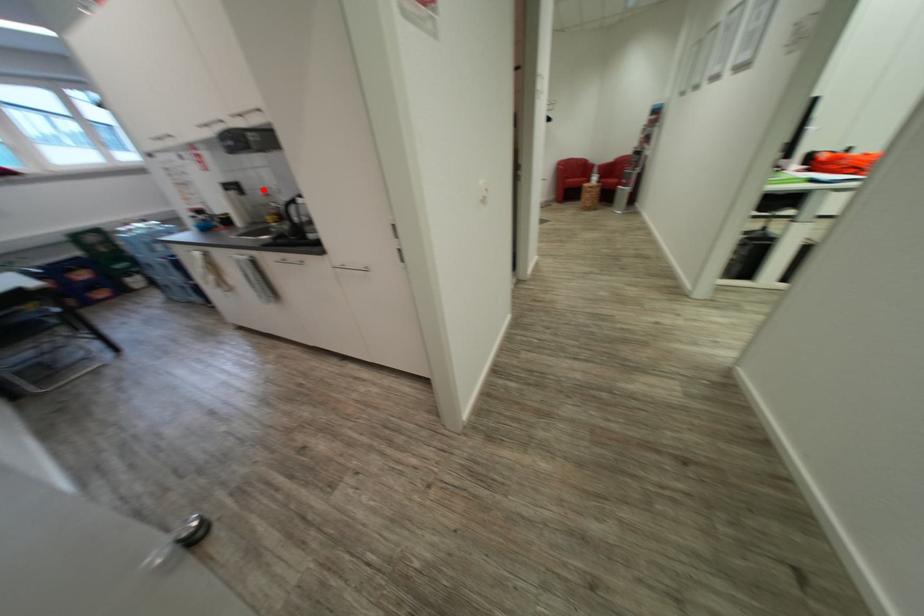
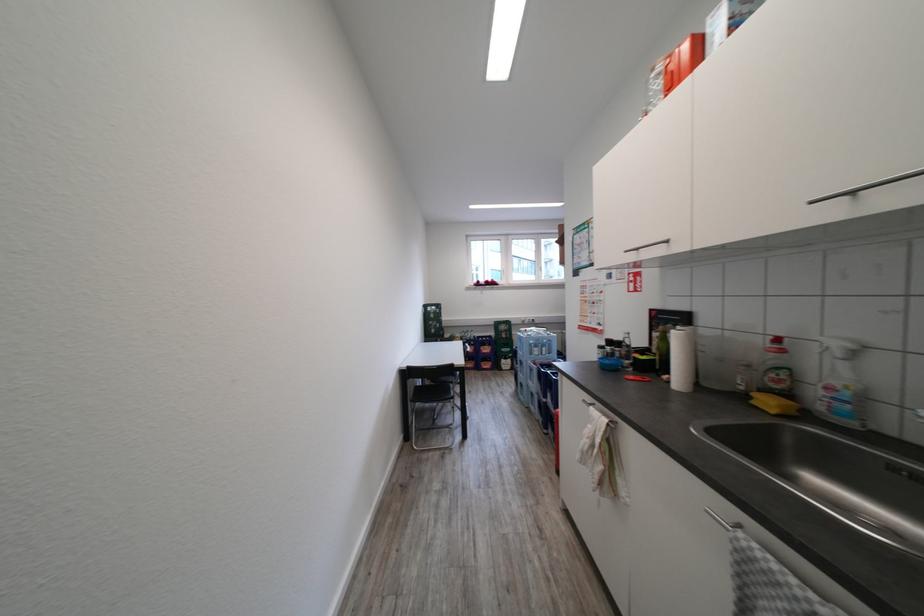
Where in the second image is the point corresponding to the highlighted location from the first image?

(776, 339)